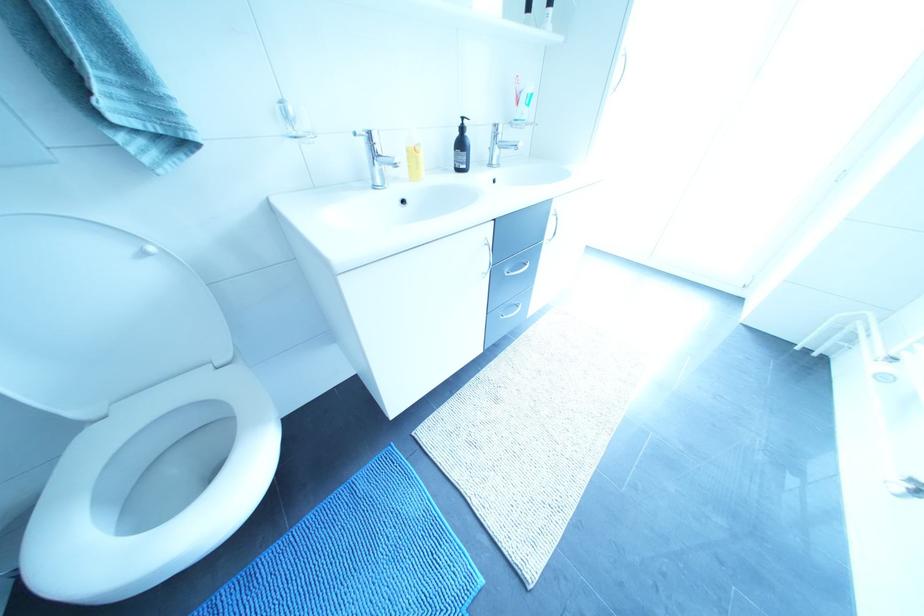
What do you see at coordinates (152, 321) in the screenshot? I see `the white toilet lid` at bounding box center [152, 321].